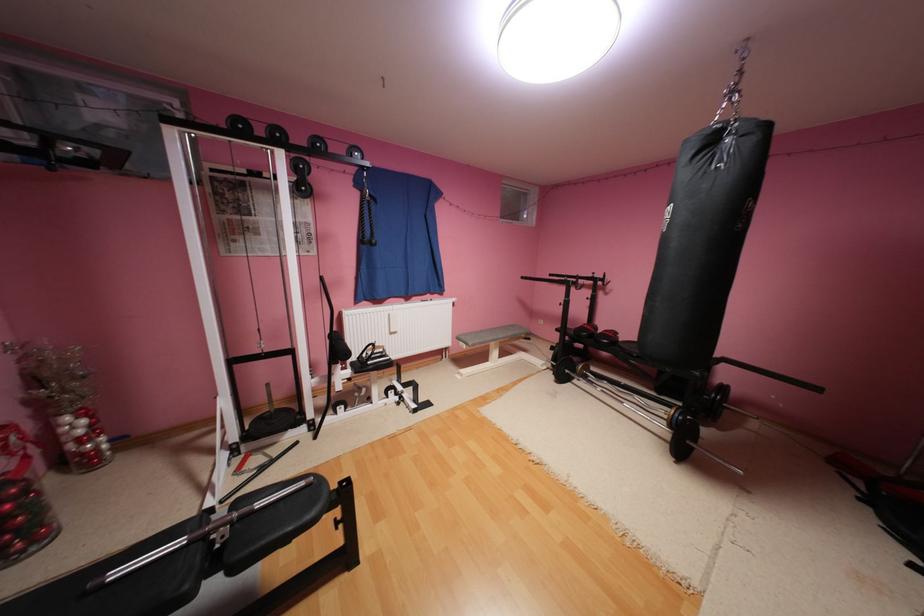
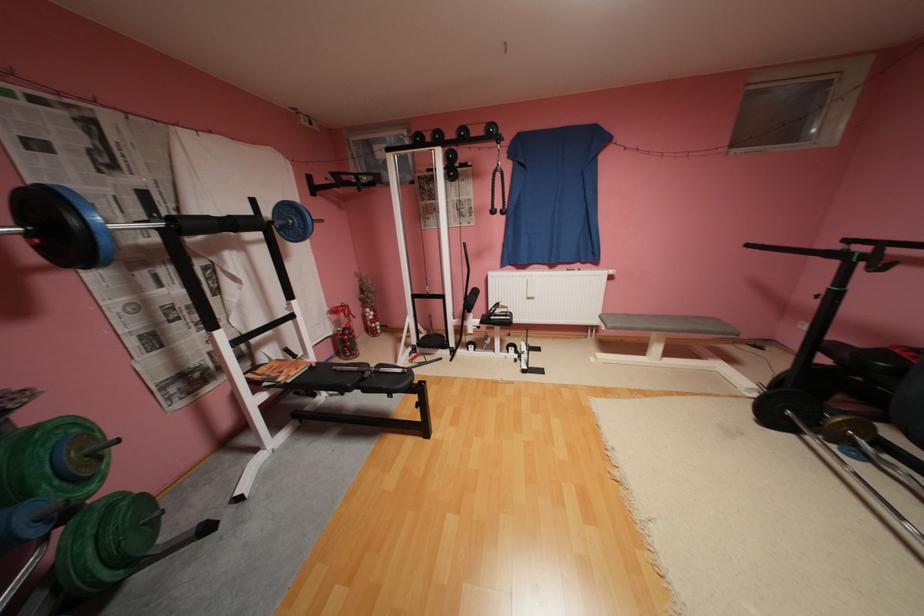
Find the pixel in the second image that matches (505,337) in the first image.

(664, 326)